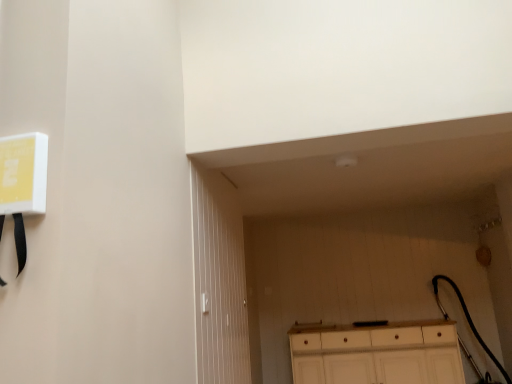
Question: From the image's perspective, is white wood cabinet at lower center positioned above or below white wooden door at center?

Choices:
 (A) above
 (B) below

Answer: (B)

Question: From a real-world perspective, is white wood cabinet at lower center physically located above or below white wooden door at center?

Choices:
 (A) below
 (B) above

Answer: (A)

Question: Is white wood cabinet at lower center inside the boundaries of white wooden door at center, or outside?

Choices:
 (A) inside
 (B) outside

Answer: (B)

Question: Is point (239, 327) positioned closer to the camera than point (288, 336)?

Choices:
 (A) farther
 (B) closer

Answer: (B)

Question: Considering the positions of white wooden door at center and white wood cabinet at lower center in the image, is white wooden door at center wider or thinner than white wood cabinet at lower center?

Choices:
 (A) thin
 (B) wide

Answer: (A)

Question: Would you say white wooden door at center is to the left or to the right of white wood cabinet at lower center in the picture?

Choices:
 (A) left
 (B) right

Answer: (A)

Question: In the image, is white wooden door at center positioned in front of or behind white wood cabinet at lower center?

Choices:
 (A) behind
 (B) front

Answer: (B)